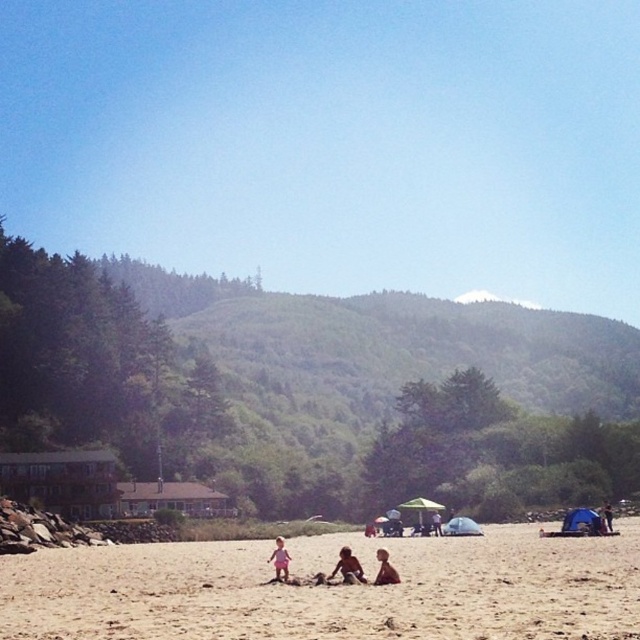
You are standing at the point marked as point (348, 566). Looking towards the green hills in the background, what type of terrain is directly behind you?

The point (348, 566) is on smooth sand at center, so behind you would be the smooth sand extending towards the beach and the sea, not the green hills in the background.

Looking at this image, you are standing at the beach and want to place a small flag at point A and point B. The coordinates for point A are point (458, 624) and point B are point (278, 552). Which point is closer to you?

Point (458, 624) is closer to the viewer than point (278, 552), so you should place the flag at point A first since it is nearer.

You are standing on the beach and want to locate the pink fabric at center. According to the coordinates provided, in which direction should you look relative to the green tent near center right?

The pink fabric at center is located at point (280, 560). Since the green tent near center right is also in the midground, the pink fabric at center is slightly to the right and closer to the center of the image compared to the green tent near center right. Therefore, you should look towards the center of the image, slightly to the right of the green tent near center right to find the pink fabric at center.